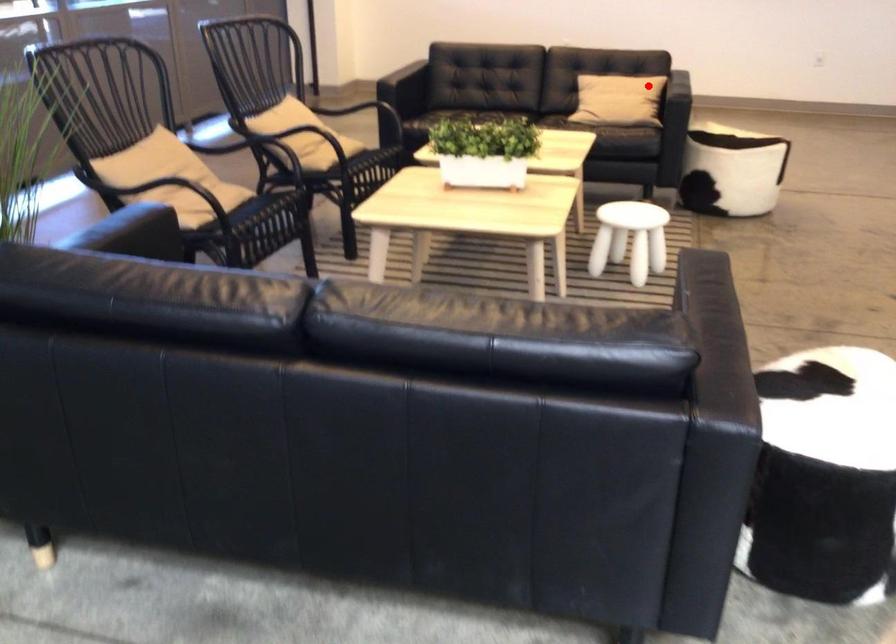
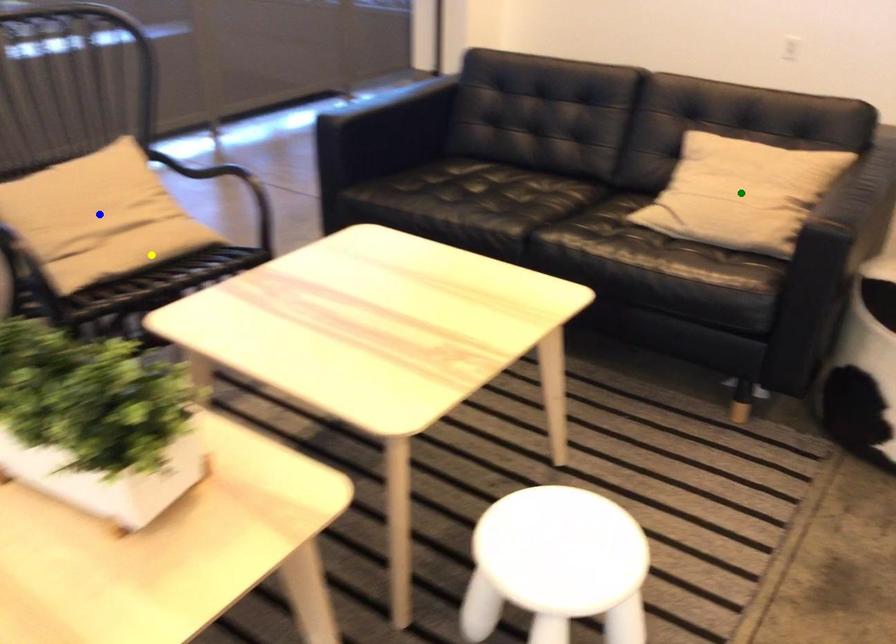
Question: I am providing you with two images of the same scene from different viewpoints. A red point is marked on the first image. You are given multiple points on the second image. Which mark in image 2 goes with the point in image 1?

Choices:
 (A) blue point
 (B) green point
 (C) yellow point

Answer: (B)